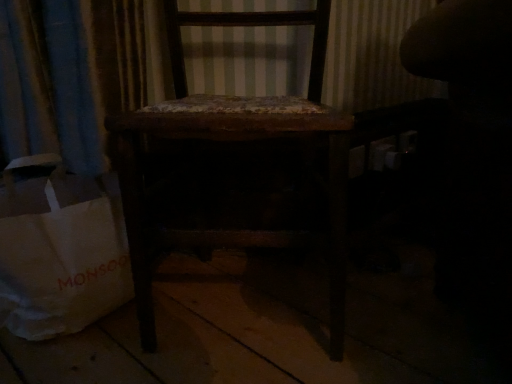
Question: Does white paper bag at lower left have a larger size compared to dark wood chair at center?

Choices:
 (A) no
 (B) yes

Answer: (A)

Question: Does white paper bag at lower left have a greater width compared to dark wood chair at center?

Choices:
 (A) yes
 (B) no

Answer: (B)

Question: Is white paper bag at lower left located outside dark wood chair at center?

Choices:
 (A) yes
 (B) no

Answer: (A)

Question: Is white paper bag at lower left aimed at dark wood chair at center?

Choices:
 (A) yes
 (B) no

Answer: (B)

Question: From the image's perspective, is white paper bag at lower left located beneath dark wood chair at center?

Choices:
 (A) yes
 (B) no

Answer: (A)

Question: Is dark wood chair at center inside white paper bag at lower left?

Choices:
 (A) yes
 (B) no

Answer: (B)

Question: Does dark wood chair at center appear on the right side of white paper bag at lower left?

Choices:
 (A) no
 (B) yes

Answer: (B)

Question: From the image's perspective, does dark wood chair at center appear higher than white paper bag at lower left?

Choices:
 (A) no
 (B) yes

Answer: (B)

Question: Is dark wood chair at center completely or partially outside of white paper bag at lower left?

Choices:
 (A) no
 (B) yes

Answer: (B)

Question: From the image's perspective, is dark wood chair at center below white paper bag at lower left?

Choices:
 (A) yes
 (B) no

Answer: (B)

Question: Does dark wood chair at center come in front of white paper bag at lower left?

Choices:
 (A) yes
 (B) no

Answer: (A)

Question: From a real-world perspective, is dark wood chair at center under white paper bag at lower left?

Choices:
 (A) no
 (B) yes

Answer: (A)

Question: Is white paper bag at lower left in front of or behind dark wood chair at center in the image?

Choices:
 (A) behind
 (B) front

Answer: (A)